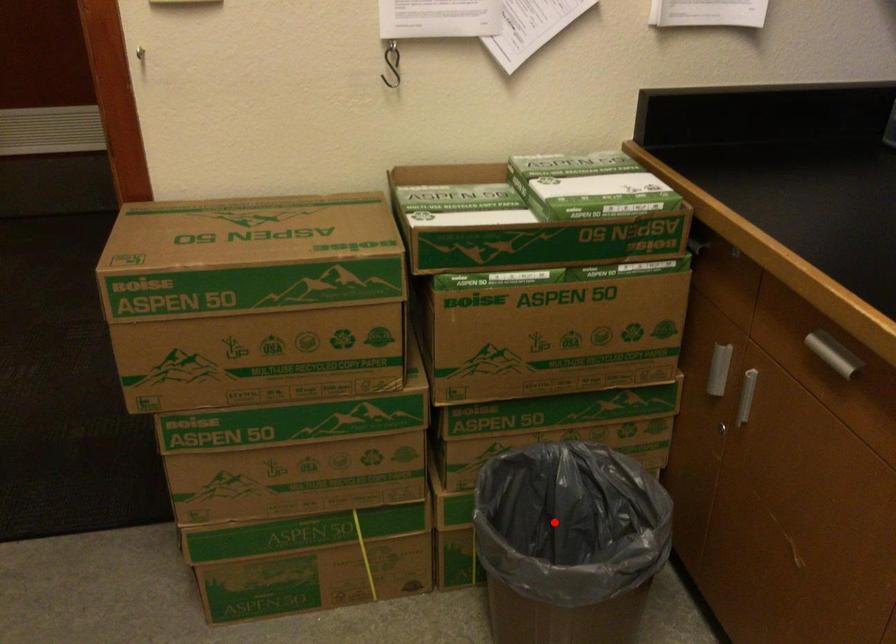
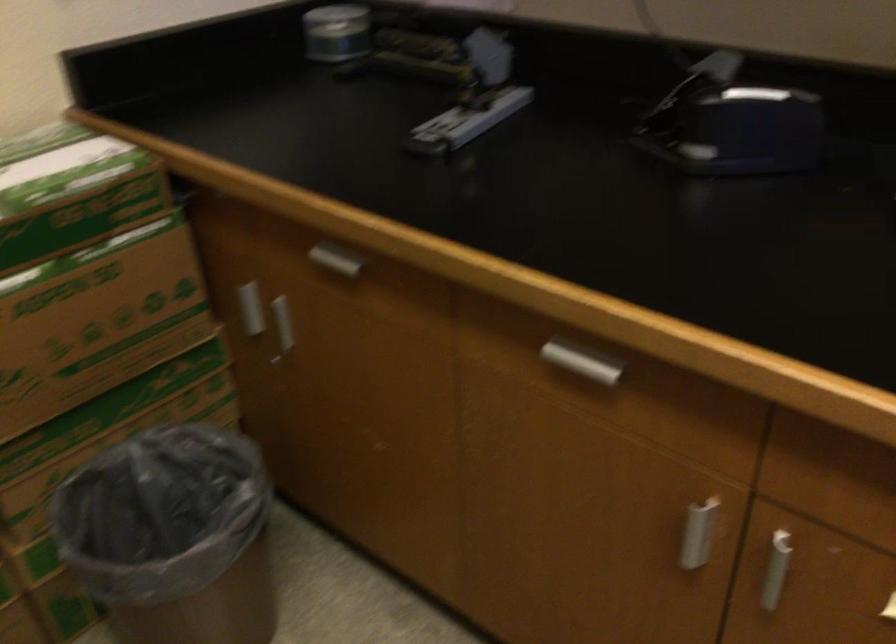
In the second image, find the point that corresponds to the highlighted location in the first image.

(159, 512)